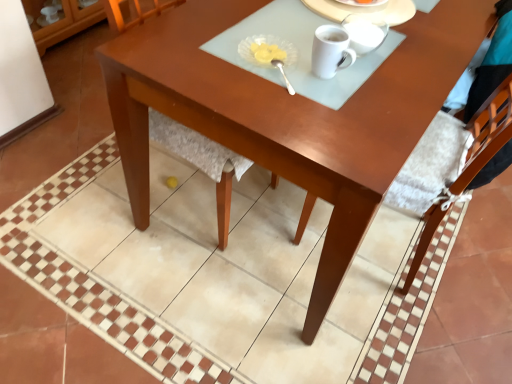
This screenshot has width=512, height=384. What are the coordinates of `unoccupied region to the right of silver metallic spoon at center, which appears as the fourth tableware when viewed from the top` in the screenshot? It's located at (343, 84).